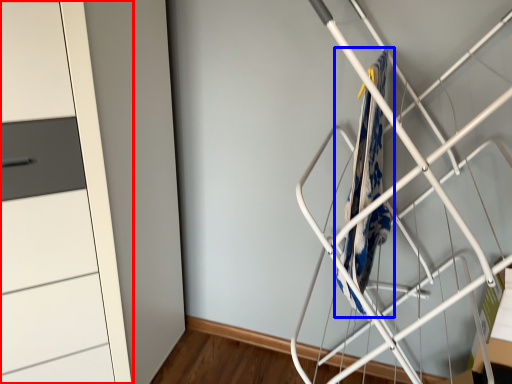
Question: Which point is further to the camera, cupboard (highlighted by a red box) or blanket (highlighted by a blue box)?

Choices:
 (A) cupboard
 (B) blanket

Answer: (B)